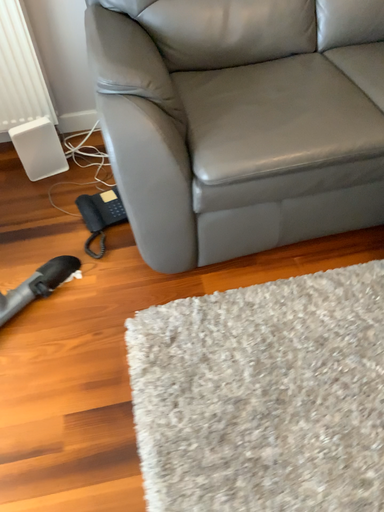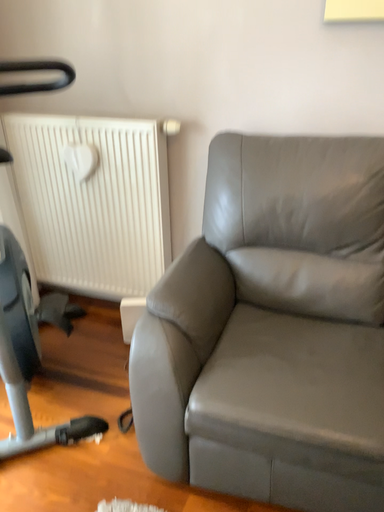
Question: How did the camera likely rotate when shooting the video?

Choices:
 (A) rotated left
 (B) rotated right

Answer: (A)